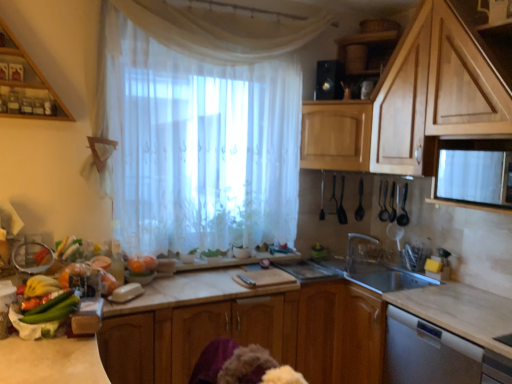
Where is `empty space that is to the right of silver metallic faucet at lower center`? The height and width of the screenshot is (384, 512). empty space that is to the right of silver metallic faucet at lower center is located at coordinates (387, 273).